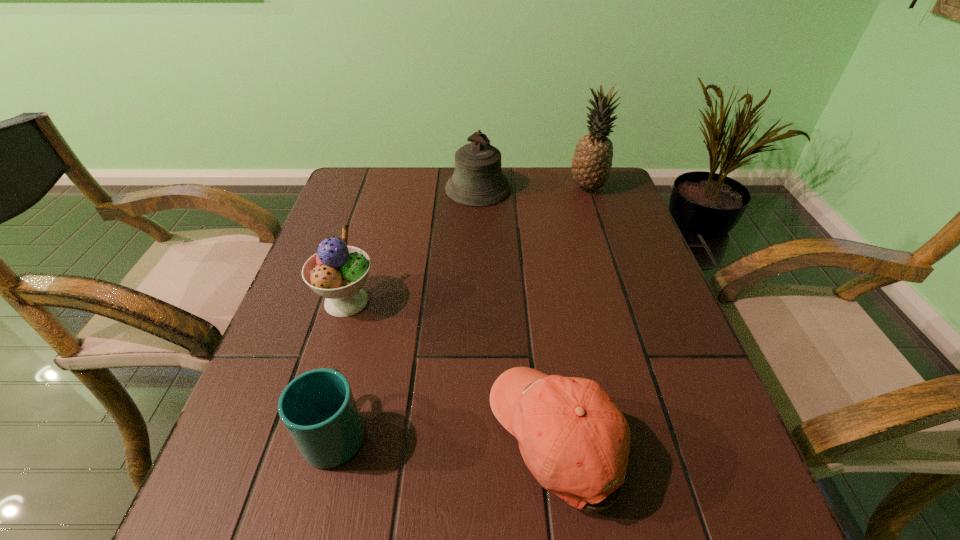
You are a GUI agent. You are given a task and a screenshot of the screen. Output one action in this format:
    pyautogui.click(x=<x>, y=<y>)
    Task: Click on the vacant point located on the handle side of the cup
    
    Given the screenshot: What is the action you would take?
    pyautogui.click(x=367, y=308)

You are a GUI agent. You are given a task and a screenshot of the screen. Output one action in this format:
    pyautogui.click(x=<x>, y=<y>)
    Task: Click on the free space located 0.080m on the handle side of the cup
    The height and width of the screenshot is (540, 960).
    Given the screenshot: What is the action you would take?
    pyautogui.click(x=354, y=358)

This screenshot has width=960, height=540. What are the coordinates of `free space located 0.100m on the handle side of the cup` in the screenshot? It's located at (356, 349).

The height and width of the screenshot is (540, 960). In order to click on pineapple located at the far edge in this screenshot , I will do `click(591, 164)`.

Find the location of a particular element. The width and height of the screenshot is (960, 540). bell positioned at the far edge is located at coordinates (477, 181).

The image size is (960, 540). Identify the location of object at the near edge. (559, 422).

You are a GUI agent. You are given a task and a screenshot of the screen. Output one action in this format:
    pyautogui.click(x=<x>, y=<y>)
    Task: Click on the icecream located in the left edge section of the desktop
    This screenshot has width=960, height=540.
    Given the screenshot: What is the action you would take?
    pyautogui.click(x=337, y=272)

What are the coordinates of `cup at the left edge` in the screenshot? It's located at (318, 409).

At what (x,y) coordinates should I click in order to perform the action: click on object that is at the right edge. Please return your answer as a coordinate pair (x, y). This screenshot has width=960, height=540. Looking at the image, I should click on (591, 164).

Identify the location of object present at the far right corner. The height and width of the screenshot is (540, 960). (591, 164).